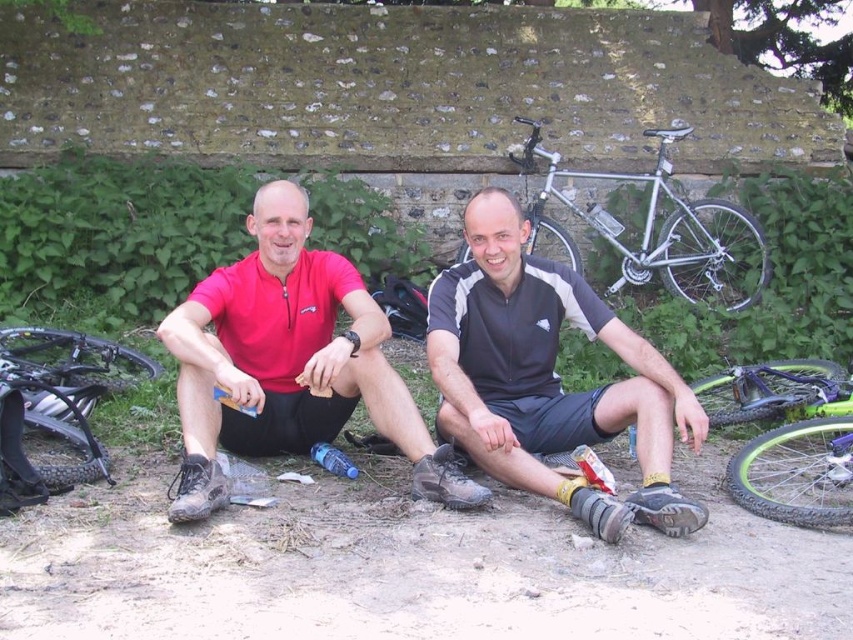
Question: Which object is positioned farthest from the brushed metal mountain bike at left?

Choices:
 (A) green rubber bicycle at lower right
 (B) silver metallic bicycle at upper right

Answer: (B)

Question: Does matte red shirt at center appear over green rubber bicycle at lower right?

Choices:
 (A) no
 (B) yes

Answer: (B)

Question: Is black matte shorts at center wider than brushed metal mountain bike at left?

Choices:
 (A) no
 (B) yes

Answer: (A)

Question: Among these points, which one is nearest to the camera?

Choices:
 (A) (526, 349)
 (B) (28, 360)
 (C) (759, 454)

Answer: (A)

Question: Which of the following is the closest to the observer?

Choices:
 (A) brushed metal mountain bike at left
 (B) green rubber bicycle at lower right
 (C) silver metallic bicycle at upper right

Answer: (B)

Question: Does black matte shorts at center come in front of matte red shirt at center?

Choices:
 (A) no
 (B) yes

Answer: (B)